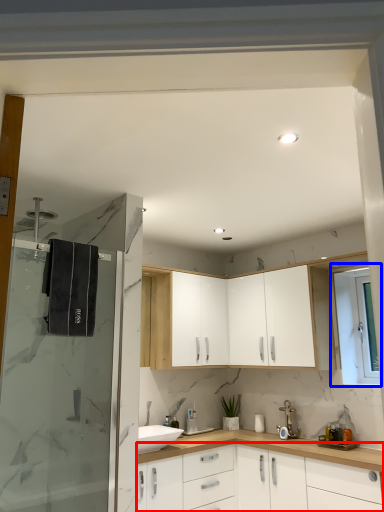
Question: Which point is further to the camera, cabinetry (highlighted by a red box) or window (highlighted by a blue box)?

Choices:
 (A) cabinetry
 (B) window

Answer: (B)